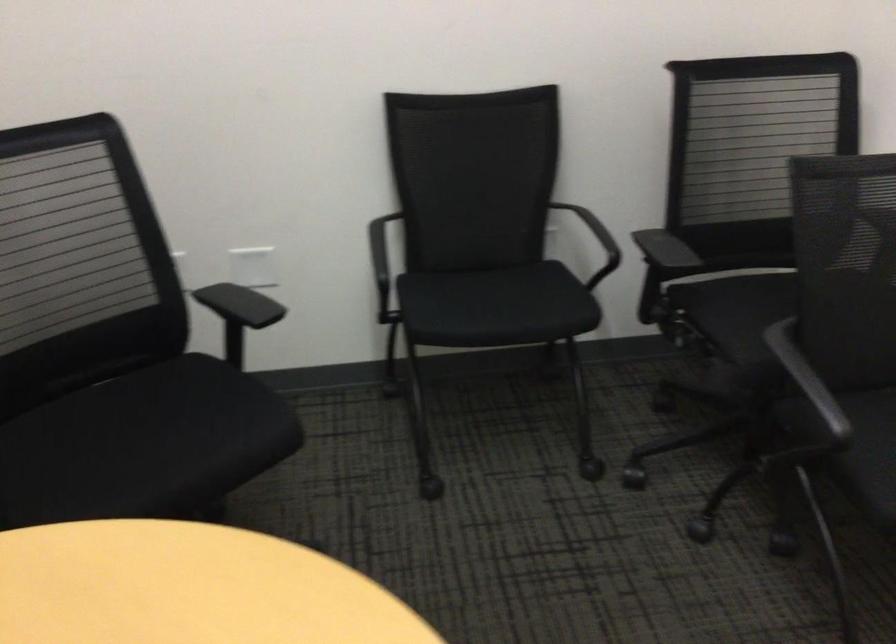
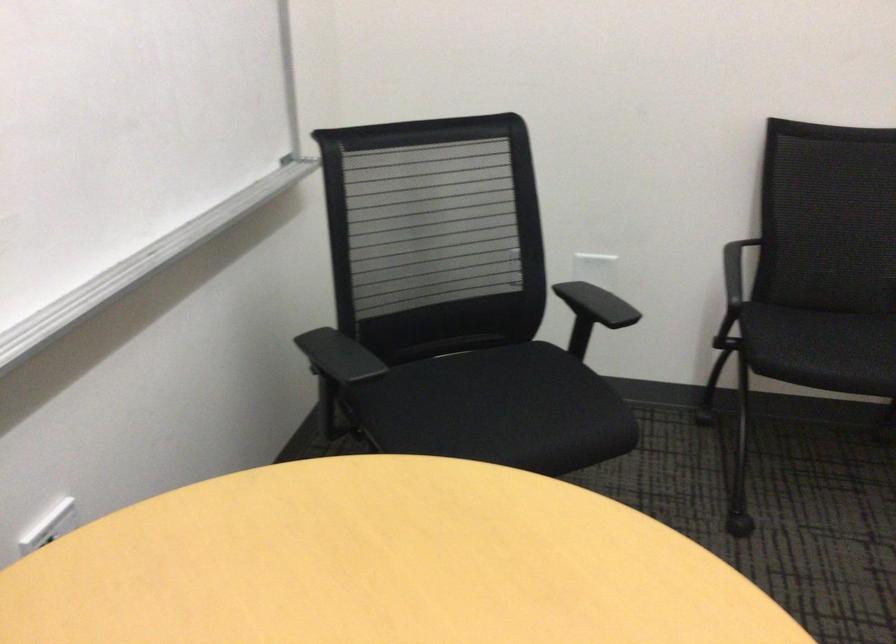
In the second image, find the point that corresponds to (x=247, y=303) in the first image.

(597, 304)